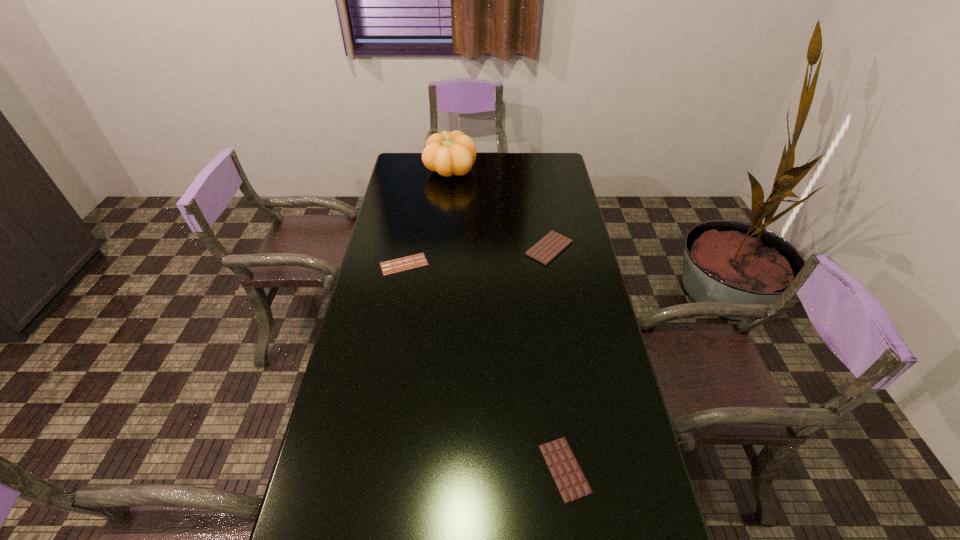
Choose which chocolate bar is the third nearest neighbor to the pumpkin. Please provide its 2D coordinates. Your answer should be formatted as a tuple, i.e. [(x, y)], where the tuple contains the x and y coordinates of a point satisfying the conditions above.

[(572, 484)]

At what (x,y) coordinates should I click in order to perform the action: click on vacant space that satisfies the following two spatial constraints: 1. on the front side of the nearest object; 2. on the right side of the tallest object. Please return your answer as a coordinate pair (x, y). This screenshot has width=960, height=540. Looking at the image, I should click on pos(422,469).